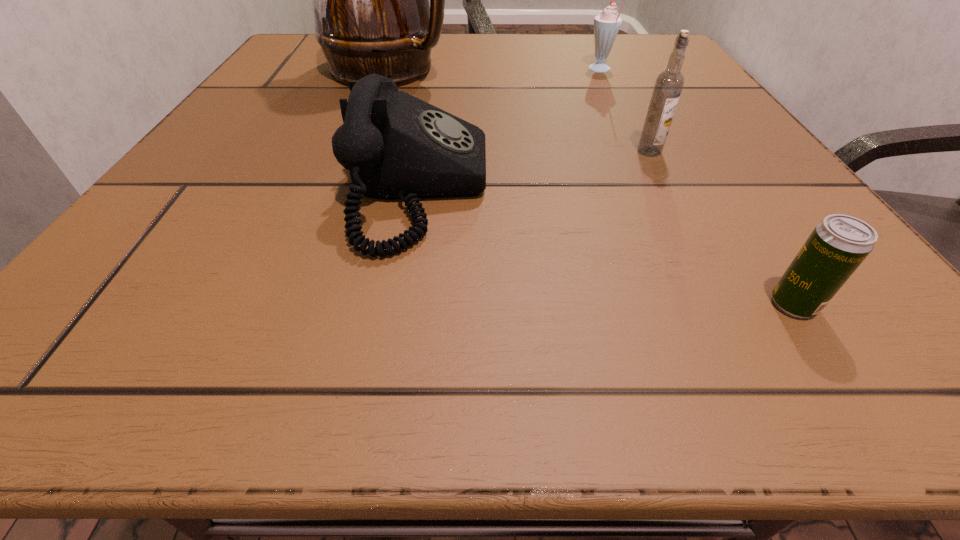
Image resolution: width=960 pixels, height=540 pixels. I want to click on vacant space situated 0.330m on the straw side of the milkshake, so click(422, 70).

I want to click on vacant region located 0.350m on the dial of the telephone, so (x=744, y=190).

Locate an element on the screen. Image resolution: width=960 pixels, height=540 pixels. vacant area situated 0.050m on the back of the nearest object is located at coordinates (762, 256).

Locate an element on the screen. The height and width of the screenshot is (540, 960). pitcher that is at the far edge is located at coordinates (370, 0).

The image size is (960, 540). In order to click on milkshake that is at the far edge in this screenshot , I will do `click(606, 25)`.

Where is `object present at the near edge`? Image resolution: width=960 pixels, height=540 pixels. object present at the near edge is located at coordinates (837, 246).

Where is `object present at the left edge`? This screenshot has width=960, height=540. object present at the left edge is located at coordinates (370, 0).

At what (x,y) coordinates should I click in order to perform the action: click on vodka that is at the right edge. Please return your answer as a coordinate pair (x, y). Looking at the image, I should click on (669, 84).

The height and width of the screenshot is (540, 960). I want to click on milkshake located at the right edge, so click(606, 25).

Identify the location of beer can at the right edge. (837, 246).